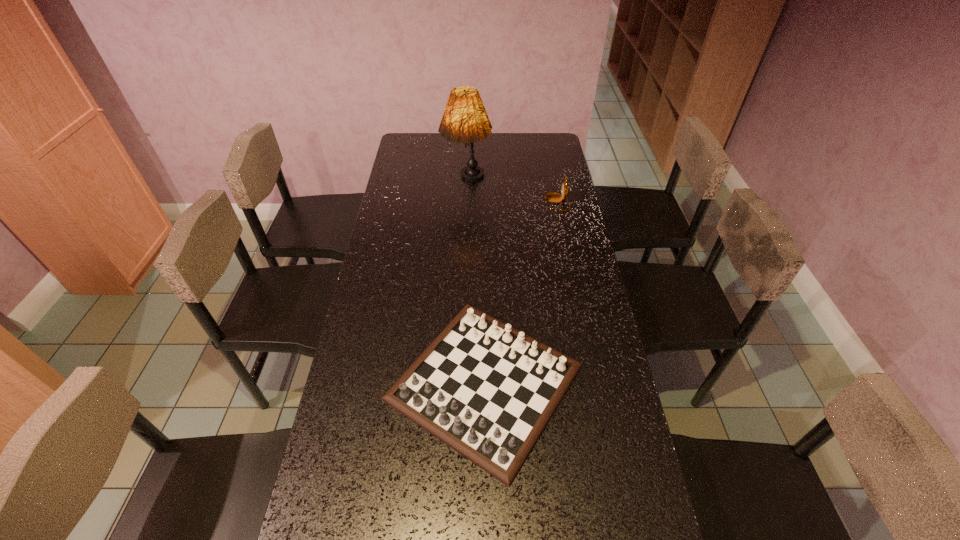
You are a GUI agent. You are given a task and a screenshot of the screen. Output one action in this format:
    pyautogui.click(x=<x>, y=<y>)
    Task: Click on the vacant space that's between the pocket watch and the lampshade
    
    Given the screenshot: What is the action you would take?
    tap(512, 193)

I want to click on free space between the second tallest object and the chessboard, so click(x=521, y=292).

Locate which object is the closest to the tallest object. Please provide its 2D coordinates. Your answer should be formatted as a tuple, i.e. [(x, y)], where the tuple contains the x and y coordinates of a point satisfying the conditions above.

[(550, 197)]

Find the location of `object that is the second closest one to the tallest object`. object that is the second closest one to the tallest object is located at coordinates (487, 390).

Where is `vacant space that satisfies the following two spatial constraints: 1. on the front-facing side of the shortest object; 2. on the right side of the lampshade`? vacant space that satisfies the following two spatial constraints: 1. on the front-facing side of the shortest object; 2. on the right side of the lampshade is located at coordinates (460, 382).

Identify the location of free space that satisfies the following two spatial constraints: 1. on the front-facing side of the nearest object; 2. on the right side of the lampshade. This screenshot has width=960, height=540. (460, 382).

In order to click on free space that satisfies the following two spatial constraints: 1. on the front-facing side of the shortest object; 2. on the left side of the tallest object in this screenshot , I will do `click(460, 382)`.

The height and width of the screenshot is (540, 960). I want to click on vacant area that satisfies the following two spatial constraints: 1. on the front-facing side of the chessboard; 2. on the left side of the tallest object, so click(x=460, y=382).

What are the coordinates of `free space in the image that satisfies the following two spatial constraints: 1. on the front-facing side of the nearest object; 2. on the left side of the lampshade` in the screenshot? It's located at (460, 382).